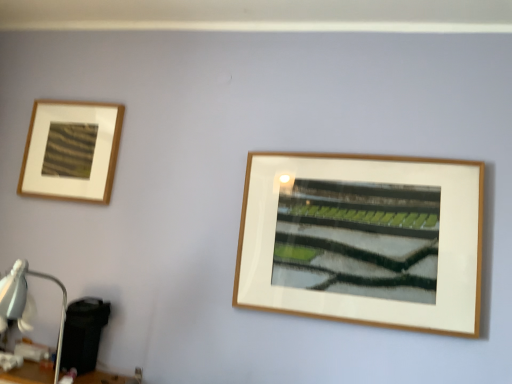
The width and height of the screenshot is (512, 384). Describe the element at coordinates (26, 300) in the screenshot. I see `matte white table lamp at lower left` at that location.

This screenshot has width=512, height=384. In order to click on wooden table at lower left in this screenshot , I will do (28, 374).

Is matte white table lamp at lower left oriented towards wooden table at lower left?

No.

Who is more distant, matte white table lamp at lower left or wooden table at lower left?

wooden table at lower left is behind.

In terms of size, does matte white table lamp at lower left appear bigger or smaller than wooden table at lower left?

In the image, matte white table lamp at lower left appears to be larger than wooden table at lower left.

Between matte white table lamp at lower left and wooden table at lower left, which one has smaller width?

Thinner between the two is wooden table at lower left.

Based on the photo, is there a large distance between matte wood picture frame at upper left and matte white table lamp at lower left?

Actually, matte wood picture frame at upper left and matte white table lamp at lower left are a little close together.

From a real-world perspective, is matte wood picture frame at upper left physically above matte white table lamp at lower left?

Yes, from a real-world perspective, matte wood picture frame at upper left is over matte white table lamp at lower left

Is matte wood picture frame at upper left bigger than matte white table lamp at lower left?

Incorrect, matte wood picture frame at upper left is not larger than matte white table lamp at lower left.

Can you tell me how much matte wood picture frame at upper left and matte white table lamp at lower left differ in facing direction?

They differ by 2.16 degrees in their facing directions.

Consider the image. Who is smaller, wooden table at lower left or matte wood picture frame at upper left?

With smaller size is wooden table at lower left.

Does point (105, 380) come closer to viewer compared to point (31, 190)?

Yes, it is.

Is matte wood picture frame at upper left at the back of wooden table at lower left?

That's not correct — wooden table at lower left is not looking away from matte wood picture frame at upper left.

Considering the relative positions of wooden table at lower left and matte wood picture frame at upper left in the image provided, is wooden table at lower left to the right of matte wood picture frame at upper left from the viewer's perspective?

Yes.

Between matte wood picture frame at upper left and wooden table at lower left, which one is positioned behind?

matte wood picture frame at upper left.

Between matte wood picture frame at upper left and wooden table at lower left, which one has smaller width?

matte wood picture frame at upper left is thinner.

Can you confirm if matte wood picture frame at upper left is positioned to the left of wooden table at lower left?

Yes.

Between matte wood picture frame at upper left and wooden table at lower left, which one has larger size?

matte wood picture frame at upper left.

Based on the photo, are wooden table at lower left and matte white table lamp at lower left beside each other?

No, wooden table at lower left is not beside matte white table lamp at lower left.

Does point (93, 380) appear closer or farther from the camera than point (20, 289)?

Point (93, 380) appears to be farther away from the viewer than point (20, 289).

Where is `table lamp located on the right of wooden table at lower left`? table lamp located on the right of wooden table at lower left is located at coordinates (26, 300).

Considering the sizes of matte white table lamp at lower left and matte wood picture frame at upper left in the image, is matte white table lamp at lower left taller or shorter than matte wood picture frame at upper left?

matte white table lamp at lower left is taller than matte wood picture frame at upper left.

Is matte white table lamp at lower left positioned far away from matte wood picture frame at upper left?

No, matte white table lamp at lower left is not far away from matte wood picture frame at upper left.

Would you say matte white table lamp at lower left is inside or outside matte wood picture frame at upper left?

The correct answer is: outside.

Identify the location of table lamp that appears in front of the wooden table at lower left. Image resolution: width=512 pixels, height=384 pixels. (26, 300).

Where is `table lamp below the matte wood picture frame at upper left (from a real-world perspective)`? table lamp below the matte wood picture frame at upper left (from a real-world perspective) is located at coordinates (26, 300).

Based on their spatial positions, is matte wood picture frame at upper left or matte white table lamp at lower left further from wooden table at lower left?

The object further to wooden table at lower left is matte wood picture frame at upper left.

Based on the photo, when comparing their distances from matte wood picture frame at upper left, does matte white table lamp at lower left or wooden table at lower left seem further?

Among the two, wooden table at lower left is located further to matte wood picture frame at upper left.

Based on their spatial positions, is matte wood picture frame at upper left or wooden table at lower left further from matte white table lamp at lower left?

matte wood picture frame at upper left.

Estimate the real-world distances between objects in this image. Which object is further from matte wood picture frame at upper left, wooden table at lower left or matte white table lamp at lower left?

wooden table at lower left lies further to matte wood picture frame at upper left than the other object.

Based on their spatial positions, is matte white table lamp at lower left or matte wood picture frame at upper left further from wooden table at lower left?

The object further to wooden table at lower left is matte wood picture frame at upper left.

Looking at the image, which one is located further to matte white table lamp at lower left, wooden table at lower left or matte wood picture frame at upper left?

Based on the image, matte wood picture frame at upper left appears to be further to matte white table lamp at lower left.

Where is `table lamp between matte wood picture frame at upper left and wooden table at lower left from top to bottom`? table lamp between matte wood picture frame at upper left and wooden table at lower left from top to bottom is located at coordinates (26, 300).